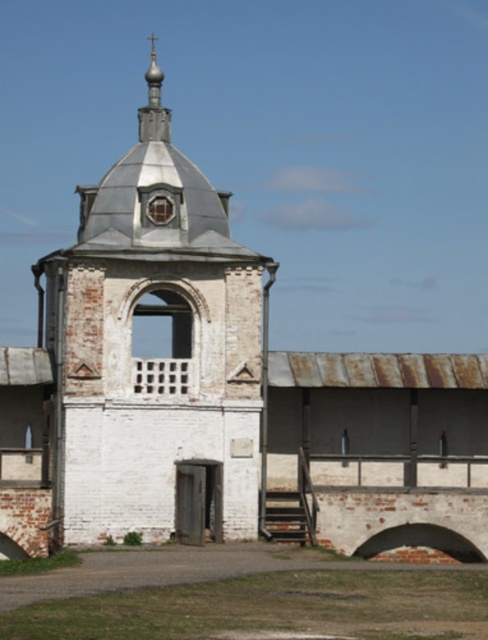
Looking at this image, which is above, white painted brick tower at center or gold textured dome at upper center?

gold textured dome at upper center is above.

Is white painted brick tower at center thinner than gold textured dome at upper center?

No, white painted brick tower at center is not thinner than gold textured dome at upper center.

What are the coordinates of `white painted brick tower at center` in the screenshot? It's located at (154, 358).